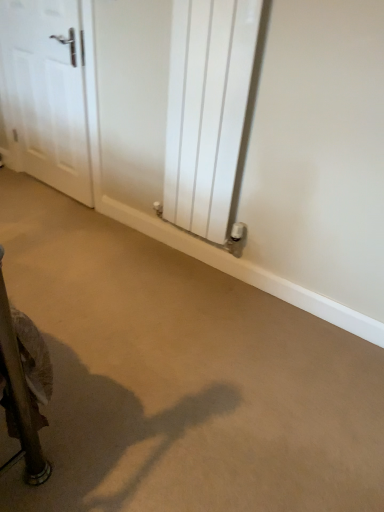
Question: Does point (210, 164) appear closer or farther from the camera than point (248, 403)?

Choices:
 (A) closer
 (B) farther

Answer: (B)

Question: Is white metallic radiator at center in front of or behind beige carpet at center in the image?

Choices:
 (A) behind
 (B) front

Answer: (A)

Question: Considering the real-world distances, which object is farthest from the beige carpet at center?

Choices:
 (A) white glossy door at upper left
 (B) white metallic radiator at center

Answer: (A)

Question: Estimate the real-world distances between objects in this image. Which object is closer to the white metallic radiator at center?

Choices:
 (A) beige carpet at center
 (B) white glossy door at upper left

Answer: (A)